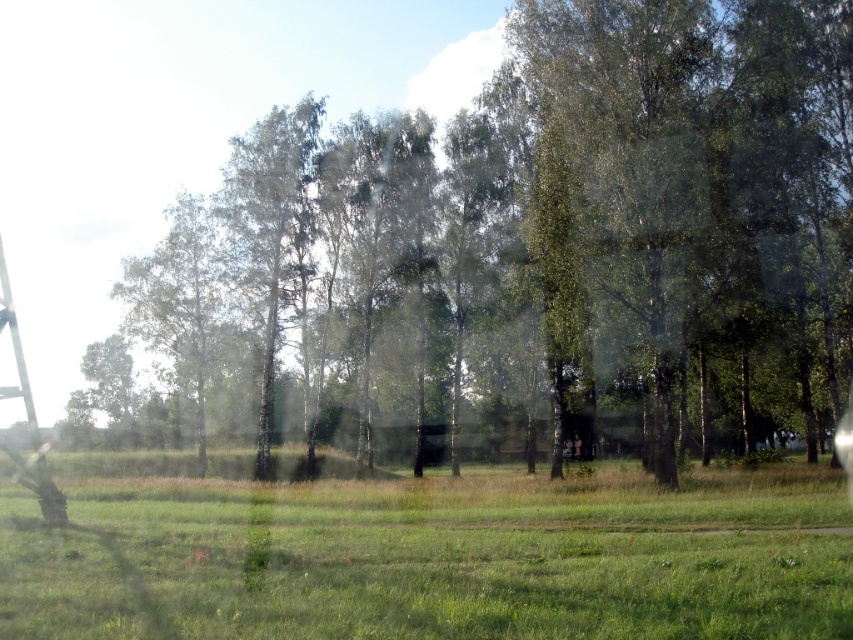
In the scene shown: You are an interior designer assessing a room with a window showing the scene described. You need to determine if the view outside the window has more green grass at center or metallic silver ladder at left in terms of area coverage. Which one covers a larger area?

The green grass at center occupies less space than metallic silver ladder at left, so the metallic silver ladder at left covers a larger area.

You are standing in a room looking through a window. You see a green leafy tree at center and green grass at center. Which object is taller?

The green leafy tree at center is much taller than the green grass at center.

You are standing in a room looking through a window. You see a green leafy tree at center and green grass at center. Which one is wider?

The green leafy tree at center might be wider than green grass at center.